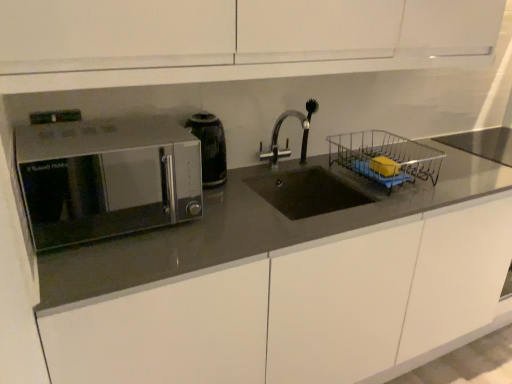
Identify the location of free spot to the right of metallic wire basket at center right. (449, 167).